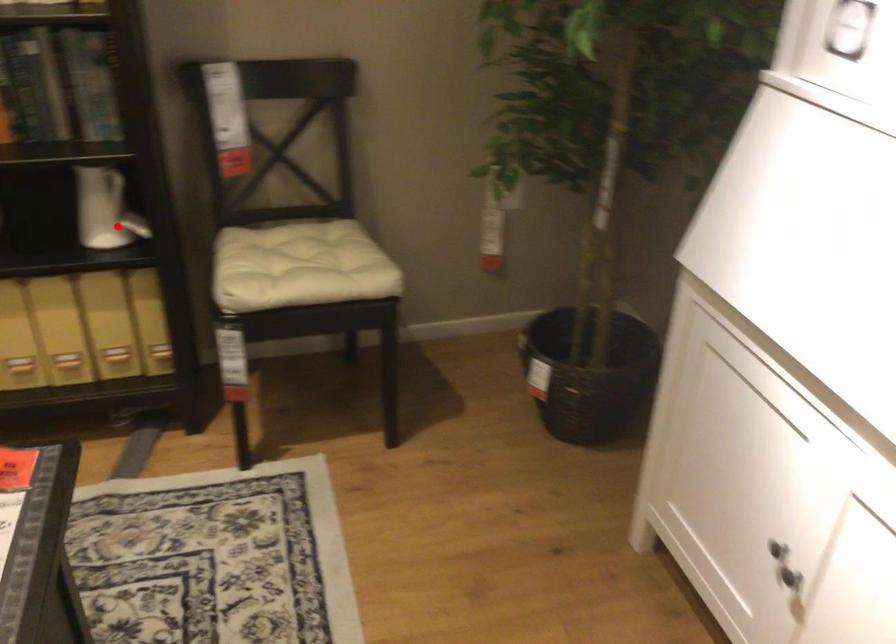
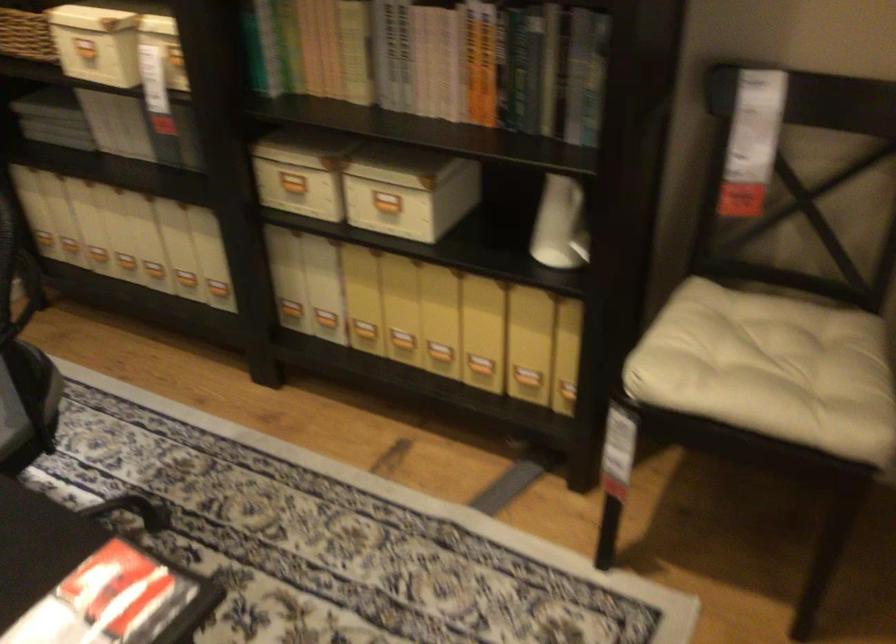
Question: I am providing you with two images of the same scene from different viewpoints. A red point is shown in image1. For the corresponding object point in image2, is it positioned nearer or farther from the camera?

Choices:
 (A) Nearer
 (B) Farther

Answer: (A)